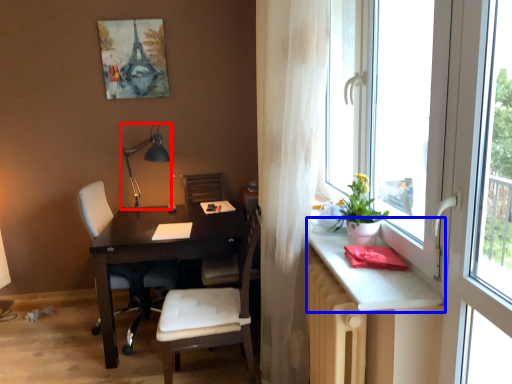
Question: Which object appears farthest to the camera in this image, table lamp (highlighted by a red box) or table (highlighted by a blue box)?

Choices:
 (A) table lamp
 (B) table

Answer: (A)